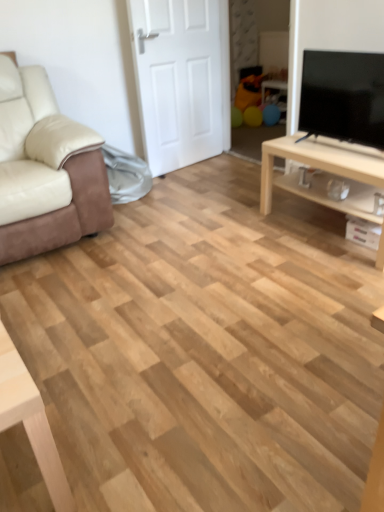
Locate an element on the screen. The width and height of the screenshot is (384, 512). vacant space to the right of white matte door at center is located at coordinates point(229,163).